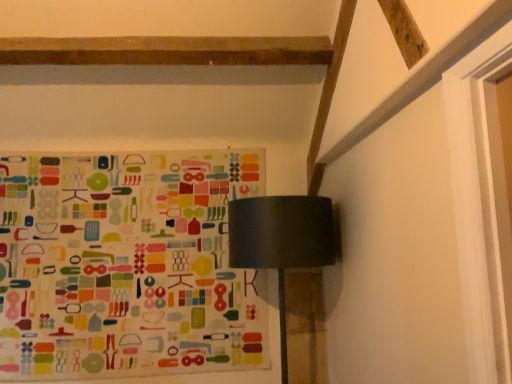
I want to click on matte black lampshade at upper center, so click(281, 241).

The width and height of the screenshot is (512, 384). What do you see at coordinates (281, 241) in the screenshot? I see `matte black lampshade at upper center` at bounding box center [281, 241].

Find the location of a particular element. The height and width of the screenshot is (384, 512). multicolored fabric bulletin board at upper center is located at coordinates (126, 265).

What do you see at coordinates (126, 265) in the screenshot? I see `multicolored fabric bulletin board at upper center` at bounding box center [126, 265].

Identify the location of matte black lampshade at upper center. This screenshot has width=512, height=384. (281, 241).

Considering the positions of objects multicolored fabric bulletin board at upper center and matte black lampshade at upper center in the image provided, who is more to the right, multicolored fabric bulletin board at upper center or matte black lampshade at upper center?

Positioned to the right is matte black lampshade at upper center.

Does multicolored fabric bulletin board at upper center lie behind matte black lampshade at upper center?

Yes, it is.

Which point is more distant from viewer, (x=263, y=170) or (x=254, y=253)?

The point (x=263, y=170) is farther from the camera.

From the image's perspective, is multicolored fabric bulletin board at upper center above or below matte black lampshade at upper center?

multicolored fabric bulletin board at upper center is situated higher than matte black lampshade at upper center in the image.

From a real-world perspective, between multicolored fabric bulletin board at upper center and matte black lampshade at upper center, who is vertically lower?

From a 3D spatial view, matte black lampshade at upper center is below.

From the picture: Can you confirm if multicolored fabric bulletin board at upper center is wider than matte black lampshade at upper center?

Incorrect, the width of multicolored fabric bulletin board at upper center does not surpass that of matte black lampshade at upper center.

Considering the sizes of multicolored fabric bulletin board at upper center and matte black lampshade at upper center in the image, is multicolored fabric bulletin board at upper center taller or shorter than matte black lampshade at upper center?

Considering their sizes, multicolored fabric bulletin board at upper center has more height than matte black lampshade at upper center.

Which of these two, multicolored fabric bulletin board at upper center or matte black lampshade at upper center, is smaller?

multicolored fabric bulletin board at upper center is smaller.

Consider the image. Is matte black lampshade at upper center inside multicolored fabric bulletin board at upper center?

No, matte black lampshade at upper center is not inside multicolored fabric bulletin board at upper center.

Is multicolored fabric bulletin board at upper center far from matte black lampshade at upper center?

No, there isn't a large distance between multicolored fabric bulletin board at upper center and matte black lampshade at upper center.

Based on the photo, is multicolored fabric bulletin board at upper center facing away from matte black lampshade at upper center?

No, multicolored fabric bulletin board at upper center's orientation is not away from matte black lampshade at upper center.

Where is `table lamp below the multicolored fabric bulletin board at upper center (from the image's perspective)`? table lamp below the multicolored fabric bulletin board at upper center (from the image's perspective) is located at coordinates (281, 241).

Considering the positions of objects matte black lampshade at upper center and multicolored fabric bulletin board at upper center in the image provided, who is more to the left, matte black lampshade at upper center or multicolored fabric bulletin board at upper center?

multicolored fabric bulletin board at upper center.

Considering their positions, is matte black lampshade at upper center located in front of or behind multicolored fabric bulletin board at upper center?

In the image, matte black lampshade at upper center appears in front of multicolored fabric bulletin board at upper center.

Which is closer to the camera, (x=310, y=199) or (x=88, y=369)?

Point (x=310, y=199) is positioned closer to the camera compared to point (x=88, y=369).

Looking at this image, from the image's perspective, who appears lower, matte black lampshade at upper center or multicolored fabric bulletin board at upper center?

matte black lampshade at upper center is shown below in the image.

From a real-world perspective, which object stands above the other?

multicolored fabric bulletin board at upper center is physically above.

Which object is wider, matte black lampshade at upper center or multicolored fabric bulletin board at upper center?

matte black lampshade at upper center is wider.

Can you confirm if matte black lampshade at upper center is taller than multicolored fabric bulletin board at upper center?

In fact, matte black lampshade at upper center may be shorter than multicolored fabric bulletin board at upper center.

Does matte black lampshade at upper center have a larger size compared to multicolored fabric bulletin board at upper center?

Yes, matte black lampshade at upper center is bigger than multicolored fabric bulletin board at upper center.

Would you say matte black lampshade at upper center is inside or outside multicolored fabric bulletin board at upper center?

matte black lampshade at upper center is not inside multicolored fabric bulletin board at upper center, it's outside.

Is the surface of matte black lampshade at upper center in direct contact with multicolored fabric bulletin board at upper center?

matte black lampshade at upper center and multicolored fabric bulletin board at upper center are clearly separated.

Is matte black lampshade at upper center turned away from multicolored fabric bulletin board at upper center?

matte black lampshade at upper center is not turned away from multicolored fabric bulletin board at upper center.

How much distance is there between matte black lampshade at upper center and multicolored fabric bulletin board at upper center?

matte black lampshade at upper center and multicolored fabric bulletin board at upper center are 26.57 inches apart.

The height and width of the screenshot is (384, 512). What are the coordinates of `bulletin board above the matte black lampshade at upper center (from the image's perspective)` in the screenshot? It's located at (126, 265).

Identify the location of bulletin board that appears on the left of matte black lampshade at upper center. The width and height of the screenshot is (512, 384). (126, 265).

The width and height of the screenshot is (512, 384). I want to click on table lamp that appears in front of the multicolored fabric bulletin board at upper center, so click(x=281, y=241).